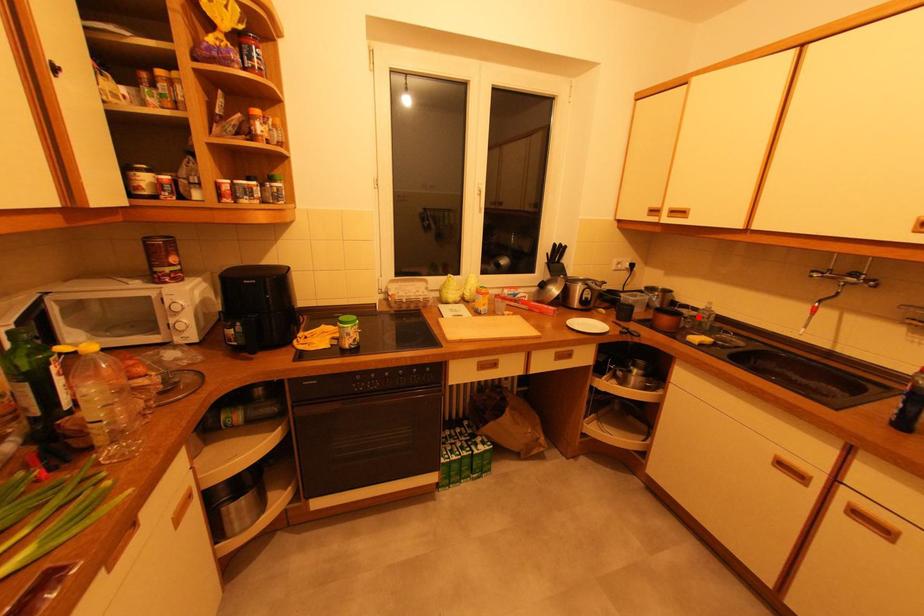
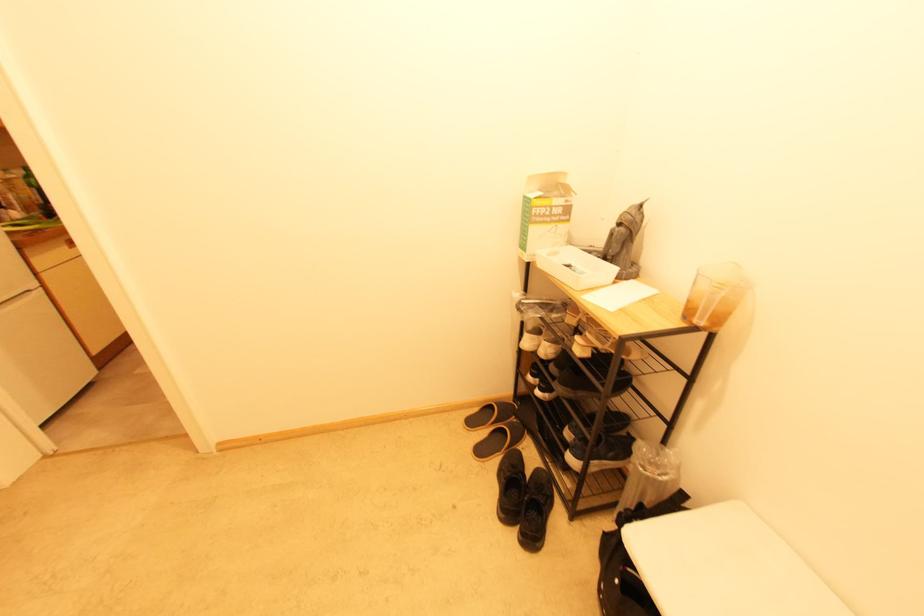
Question: I am providing you with two images of the same scene from different viewpoints. A red point is marked on the first image. At the location where the point appears in image 1, is it still visible in image 2?

Choices:
 (A) Yes
 (B) No

Answer: (B)